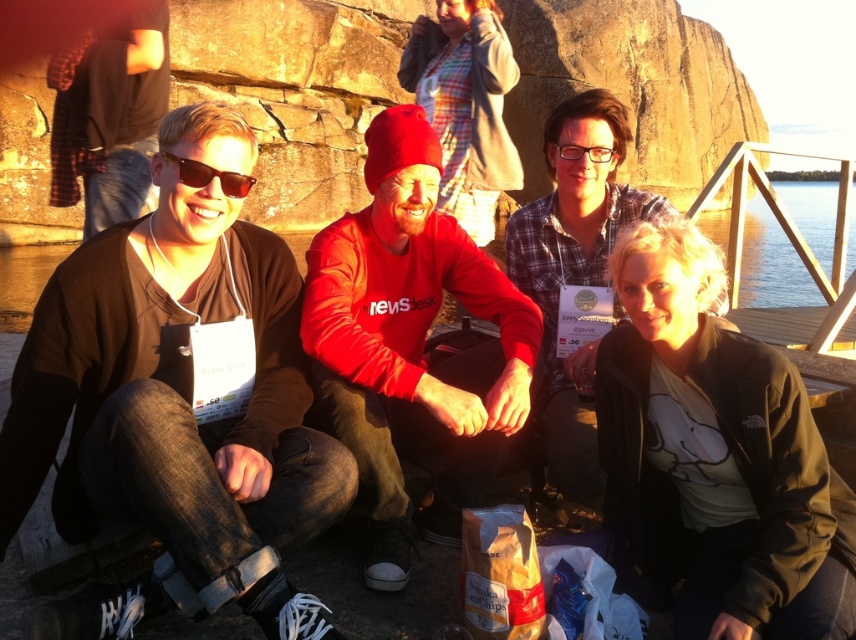
Looking at this image, you are trying to decide which pair of glasses to take with you for a hike. You have the matte black sunglasses at left and the clear plastic glasses at center. Based on their sizes, which one might be more comfortable to wear for an extended period?

The matte black sunglasses at left has a larger size compared to clear plastic glasses at center, so it might be more comfortable for an extended period as larger frames can provide better coverage and stability.

Consider the image. You are a photographer trying to capture the group of four individuals sitting outdoors near the water. You want to focus on the person wearing the matte black sunglasses at left. Where should you aim your camera to ensure the sunglasses are in the frame?

You should aim your camera at point (210,176) to ensure the matte black sunglasses at left are in the frame.